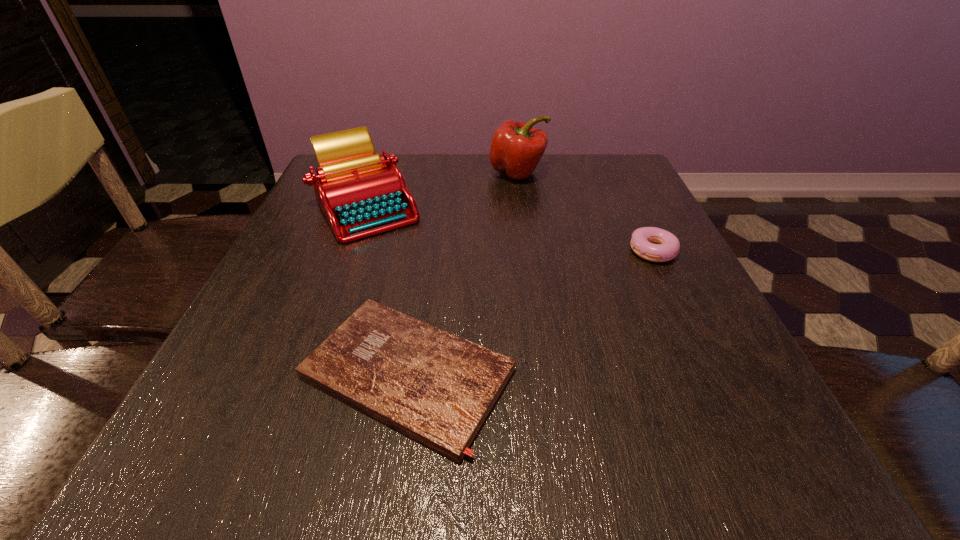
The height and width of the screenshot is (540, 960). Identify the location of pepper at the far edge. (516, 148).

Locate an element on the screen. This screenshot has width=960, height=540. typewriter situated at the far edge is located at coordinates (360, 193).

The width and height of the screenshot is (960, 540). What are the coordinates of `object located at the near edge` in the screenshot? It's located at (438, 388).

I want to click on typewriter present at the left edge, so click(x=360, y=193).

Where is `Bible positioned at the left edge`? Image resolution: width=960 pixels, height=540 pixels. Bible positioned at the left edge is located at coordinates (438, 388).

Where is `object that is at the right edge`? This screenshot has height=540, width=960. object that is at the right edge is located at coordinates (654, 244).

You are a GUI agent. You are given a task and a screenshot of the screen. Output one action in this format:
    pyautogui.click(x=<x>, y=<y>)
    Task: Click on the object present at the far left corner
    Image resolution: width=960 pixels, height=540 pixels.
    Given the screenshot: What is the action you would take?
    pyautogui.click(x=360, y=193)

What are the coordinates of `object at the near left corner` in the screenshot? It's located at (438, 388).

In the image, there is a desktop. Where is `vacant space at the far edge`? vacant space at the far edge is located at coordinates (557, 183).

In the image, there is a desktop. Where is `vacant region at the near edge`? vacant region at the near edge is located at coordinates (536, 425).